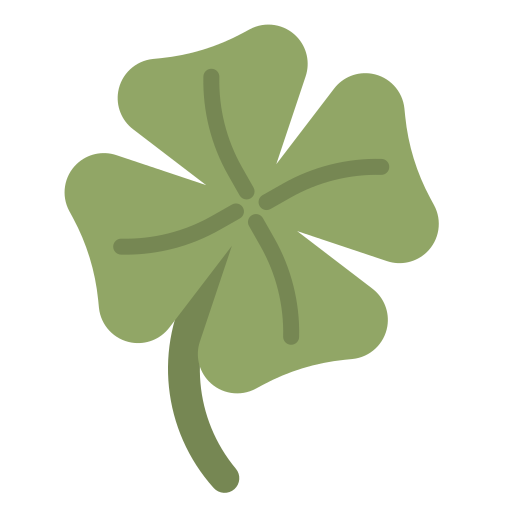
Identify the location of plant. (255, 206).